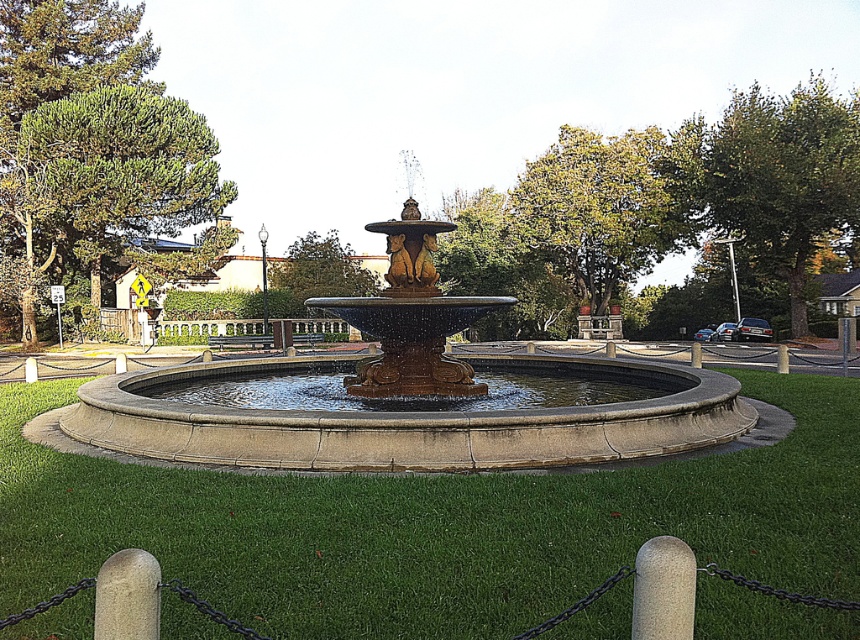
From the picture: Between green grass at center and polished bronze fountain at center, which one appears on the left side from the viewer's perspective?

green grass at center is more to the left.

Which of these two, green grass at center or polished bronze fountain at center, stands shorter?

green grass at center is shorter.

Is point (9, 532) in front of point (312, 449)?

Yes, point (9, 532) is in front of point (312, 449).

This screenshot has width=860, height=640. In order to click on green grass at center in this screenshot , I will do `click(433, 525)`.